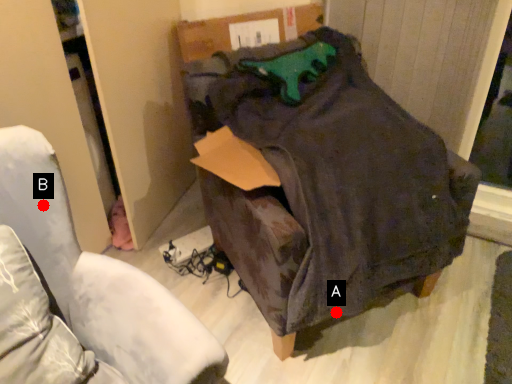
Question: Two points are circled on the image, labeled by A and B beside each circle. Which point is closer to the camera?

Choices:
 (A) A is closer
 (B) B is closer

Answer: (B)